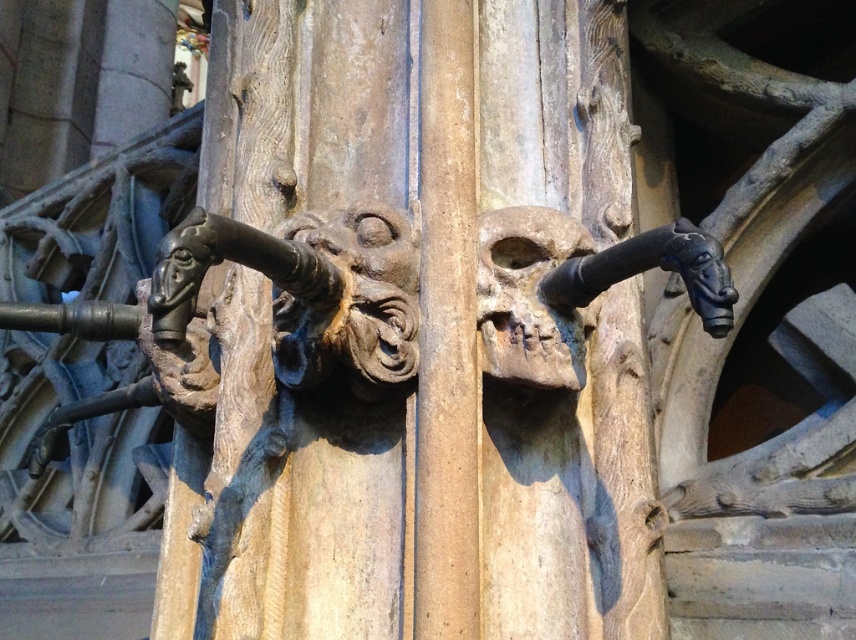
Question: Does brown stone skull at center have a lesser width compared to black metal/bronze at upper center?

Choices:
 (A) no
 (B) yes

Answer: (B)

Question: In this image, where is brown stone skull at center located relative to black metal/bronze at upper center?

Choices:
 (A) below
 (B) above

Answer: (A)

Question: Is brown stone skull at center to the right of black metal/bronze at upper center from the viewer's perspective?

Choices:
 (A) yes
 (B) no

Answer: (B)